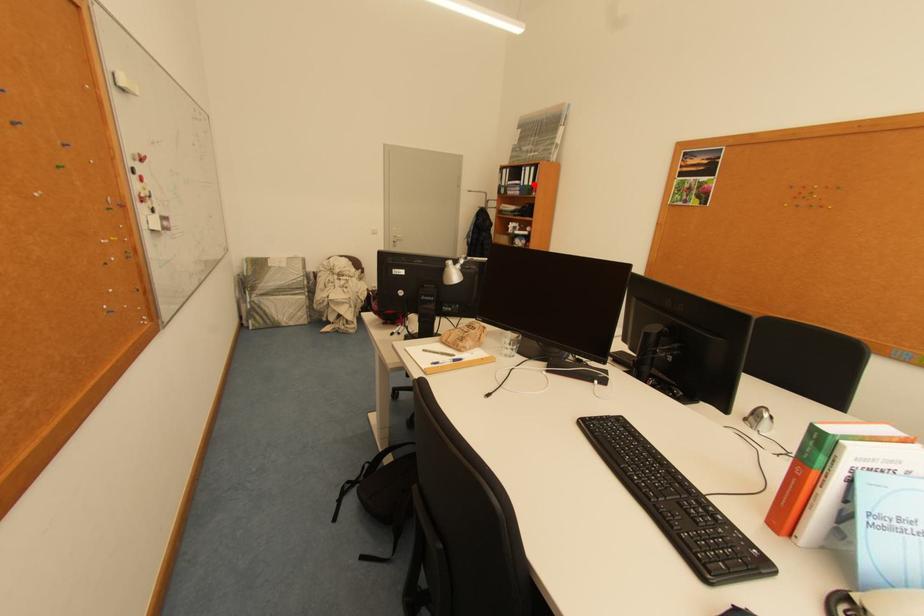
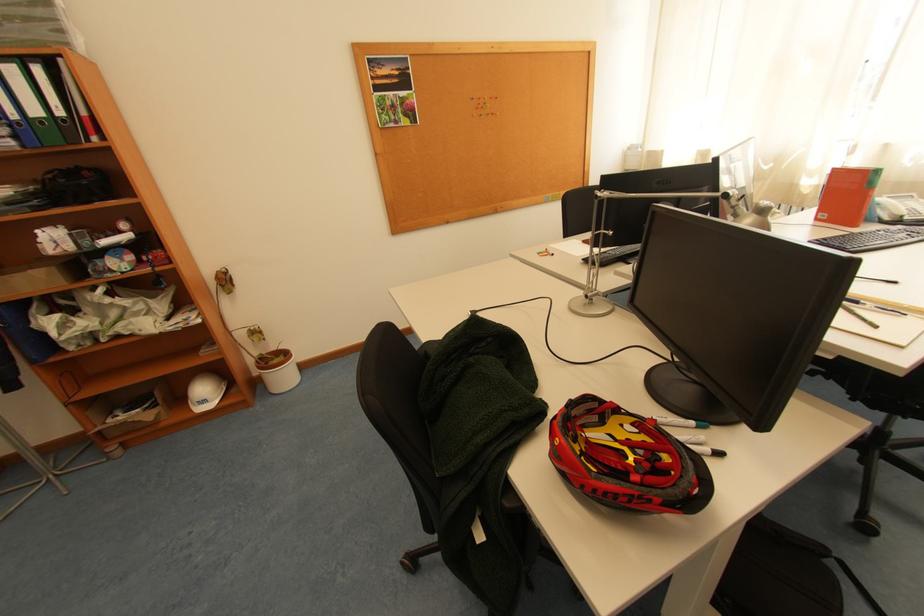
Question: I am providing you with two images of the same scene from different viewpoints. A red point is marked on the first image. Is the red point's position out of view in image 2?

Choices:
 (A) Yes
 (B) No

Answer: (B)